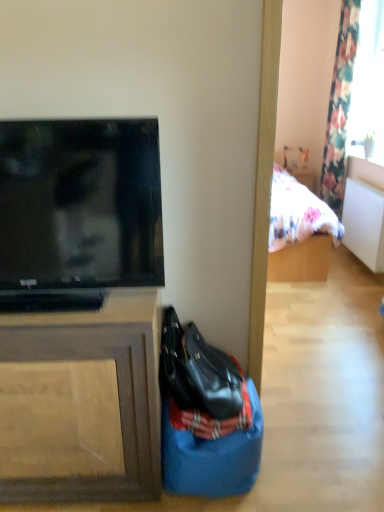
Question: Based on their sizes in the image, would you say floral fabric curtain at upper right is bigger or smaller than blue fabric sack at lower center?

Choices:
 (A) small
 (B) big

Answer: (B)

Question: Relative to blue fabric sack at lower center, is floral fabric curtain at upper right in front or behind?

Choices:
 (A) behind
 (B) front

Answer: (A)

Question: Estimate the real-world distances between objects in this image. Which object is closer to the matte black television at left?

Choices:
 (A) transparent glass window at upper right
 (B) shiny black handbag at lower center
 (C) blue fabric sack at lower center
 (D) floral fabric curtain at upper right
 (E) brown wood cabinet at left

Answer: (E)

Question: Considering the real-world distances, which object is farthest from the blue fabric sack at lower center?

Choices:
 (A) matte black television at left
 (B) floral fabric curtain at upper right
 (C) transparent glass window at upper right
 (D) brown wood cabinet at left
 (E) shiny black handbag at lower center

Answer: (B)